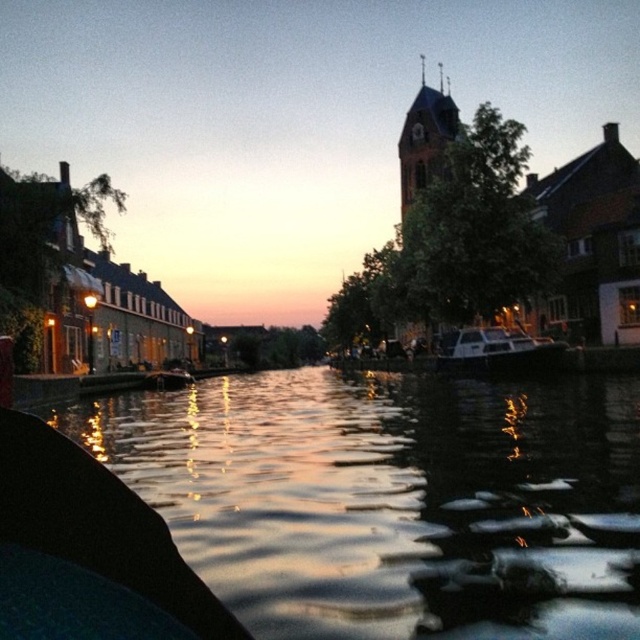
You are standing on the dock and see the silvery reflective water at center and the wooden boat at center. Which object is higher from the ground?

The silvery reflective water at center is much taller than the wooden boat at center, so the silvery reflective water at center is higher from the ground.

You are standing at the point with coordinates point (x=176, y=378) and want to walk towards the point with coordinates point (x=500, y=365). According to the scene, will you be moving towards the canal or away from it?

Since point (x=500, y=365) is in front of point (x=176, y=378), you are moving towards the canal.